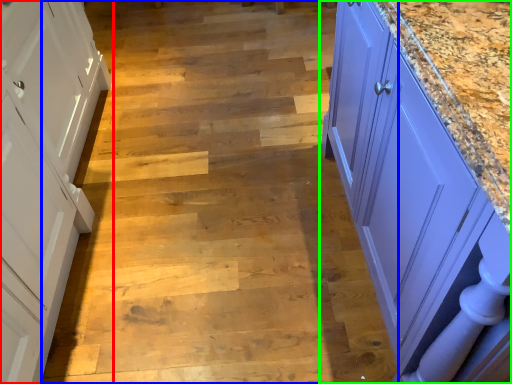
Question: Which is farther away from cabinetry (highlighted by a red box)? stair (highlighted by a blue box) or countertop (highlighted by a green box)?

Choices:
 (A) stair
 (B) countertop

Answer: (B)